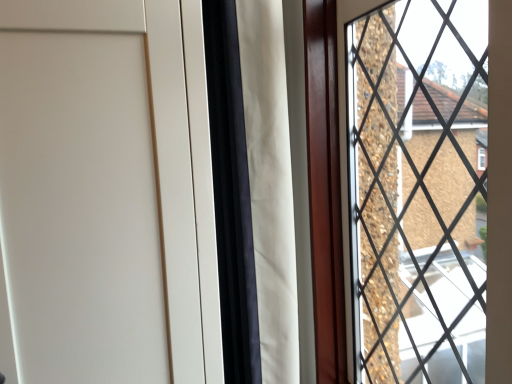
Find the location of a particular element. black metal grid at upper right is located at coordinates (415, 193).

Image resolution: width=512 pixels, height=384 pixels. Describe the element at coordinates (415, 193) in the screenshot. I see `black metal grid at upper right` at that location.

Where is `black metal grid at upper right`? The width and height of the screenshot is (512, 384). black metal grid at upper right is located at coordinates (415, 193).